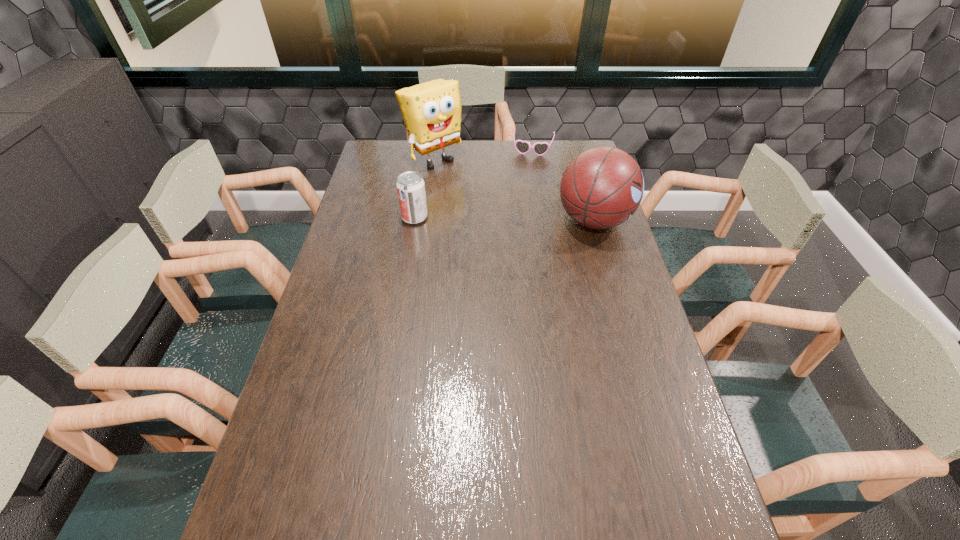
You are a GUI agent. You are given a task and a screenshot of the screen. Output one action in this format:
    pyautogui.click(x=<x>, y=<y>)
    Task: Click on the vacant space situated on the front-facing side of the shortest object
    This screenshot has height=540, width=960.
    Given the screenshot: What is the action you would take?
    pyautogui.click(x=526, y=183)

Identify the location of free space located on the front-facing side of the shortest object. (528, 174).

This screenshot has width=960, height=540. What are the coordinates of `sponge situated at the far edge` in the screenshot? It's located at (431, 111).

Locate an element on the screen. sunglasses that is positioned at the far edge is located at coordinates (523, 147).

This screenshot has width=960, height=540. Identify the location of object that is positioned at the left edge. (431, 111).

At what (x,y) coordinates should I click in order to perform the action: click on basketball that is at the right edge. Please return your answer as a coordinate pair (x, y). The image size is (960, 540). Looking at the image, I should click on (601, 188).

This screenshot has width=960, height=540. Identify the location of sunglasses that is at the right edge. (523, 147).

This screenshot has width=960, height=540. I want to click on object that is at the far left corner, so coord(431,111).

You are a GUI agent. You are given a task and a screenshot of the screen. Output one action in this format:
    pyautogui.click(x=<x>, y=<y>)
    Task: Click on the object present at the far right corner
    
    Given the screenshot: What is the action you would take?
    pyautogui.click(x=523, y=147)

The width and height of the screenshot is (960, 540). In the image, there is a desktop. What are the coordinates of `free space at the far edge` in the screenshot? It's located at (442, 150).